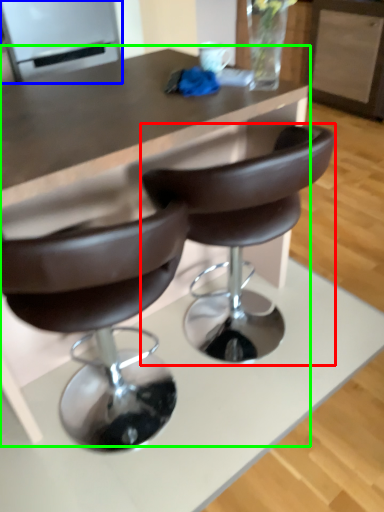
Question: Which is nearer to the chair (highlighted by a red box)? appliance (highlighted by a blue box) or table (highlighted by a green box).

Choices:
 (A) appliance
 (B) table

Answer: (B)